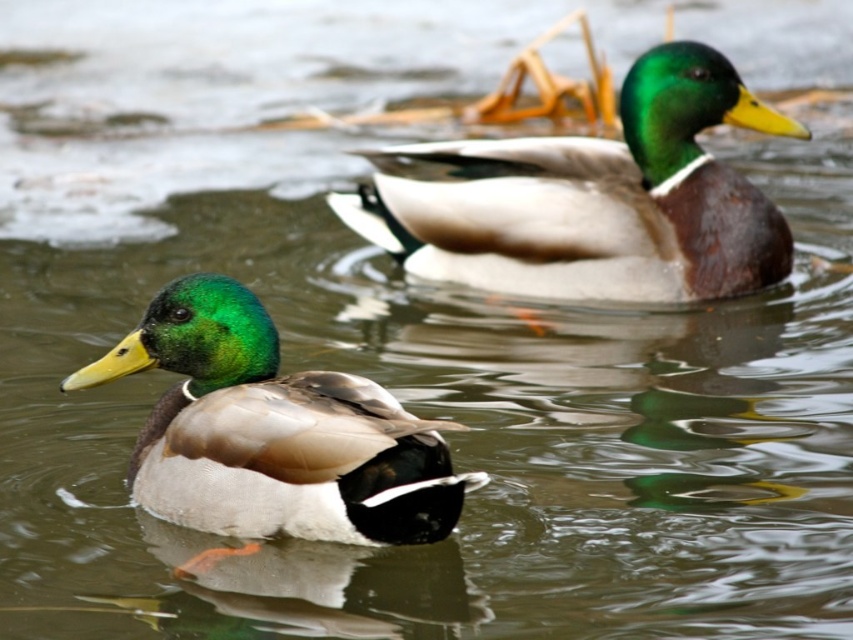
Between shiny brown duck at upper center and shiny green duck at center, which one is positioned higher?

Positioned higher is shiny brown duck at upper center.

Who is more forward, (590, 250) or (381, 406)?

Point (381, 406)

Does point (740, 180) come farther from viewer compared to point (384, 435)?

Yes, point (740, 180) is farther from viewer.

This screenshot has height=640, width=853. What are the coordinates of `shiny brown duck at upper center` in the screenshot? It's located at (595, 198).